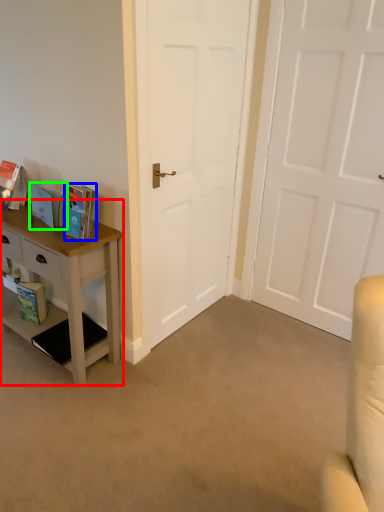
Question: Which object is positioned farthest from nightstand (highlighted by a red box)? Select from book (highlighted by a blue box) and book (highlighted by a green box).

Choices:
 (A) book
 (B) book

Answer: (A)